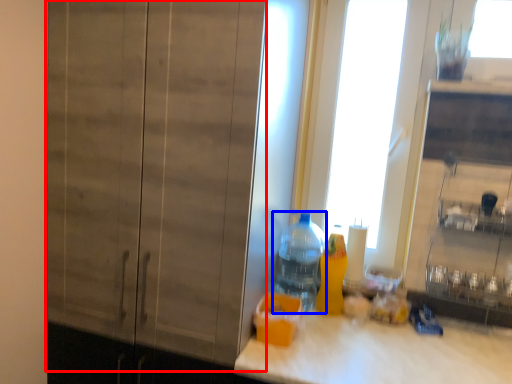
Question: Among these objects, which one is nearest to the camera, barn door (highlighted by a red box) or bottle (highlighted by a blue box)?

Choices:
 (A) barn door
 (B) bottle

Answer: (A)